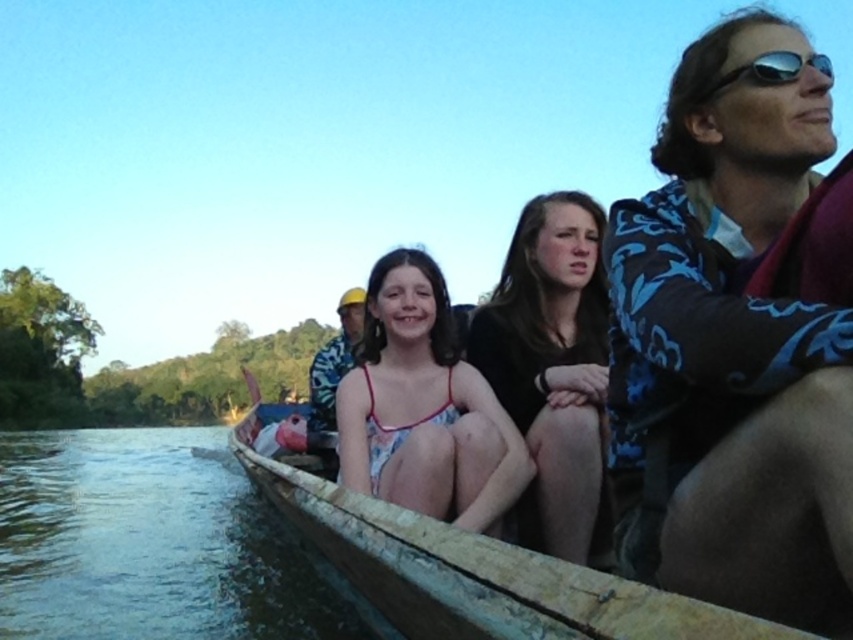
You are a photographer taking pictures from the shore and want to capture both the blue floral shirt at upper right and the white floral dress at center in the same frame. Which of the two clothing items is positioned higher in the image?

The blue floral shirt at upper right is located above the white floral dress at center, so it is positioned higher in the image.

You are a photographer standing on the riverbank and want to take a photo of the white floral dress at center and sunglasses at upper right in the boat. The minimum distance between the two objects in the photo should be 10 feet to ensure both are clearly visible. Can you capture them in one shot?

The white floral dress at center and sunglasses at upper right are 11.11 feet apart, which exceeds the minimum required distance of 10 feet. Yes, you can capture both in one shot while maintaining clarity.

You are a photographer trying to capture a closeup shot of the white floral dress at center and the sunglasses at upper right. Since you want both subjects to be in focus, you need to know which one is bigger in the frame. Which object is larger?

The white floral dress at center is larger compared to the sunglasses at upper right, so you should focus on capturing the white floral dress at center first as it takes up more space in the frame.